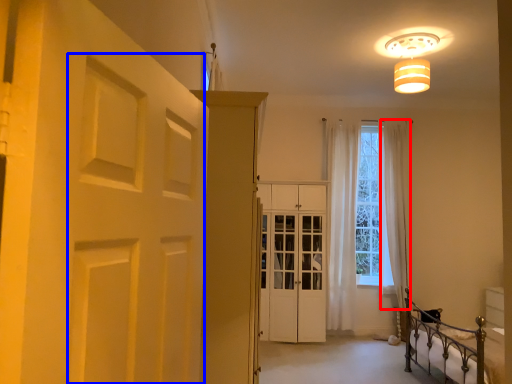
Question: Which object appears closest to the camera in this image, curtain (highlighted by a red box) or shutter (highlighted by a blue box)?

Choices:
 (A) curtain
 (B) shutter

Answer: (B)